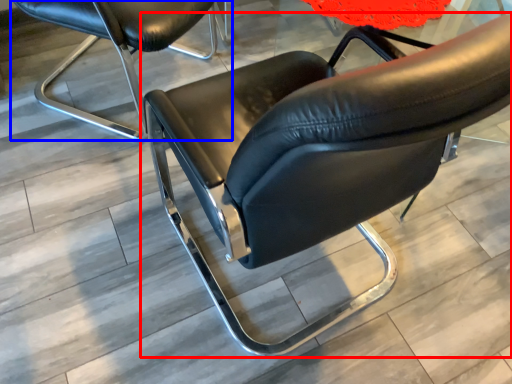
Question: Which object appears closest to the camera in this image, chair (highlighted by a red box) or chair (highlighted by a blue box)?

Choices:
 (A) chair
 (B) chair

Answer: (A)